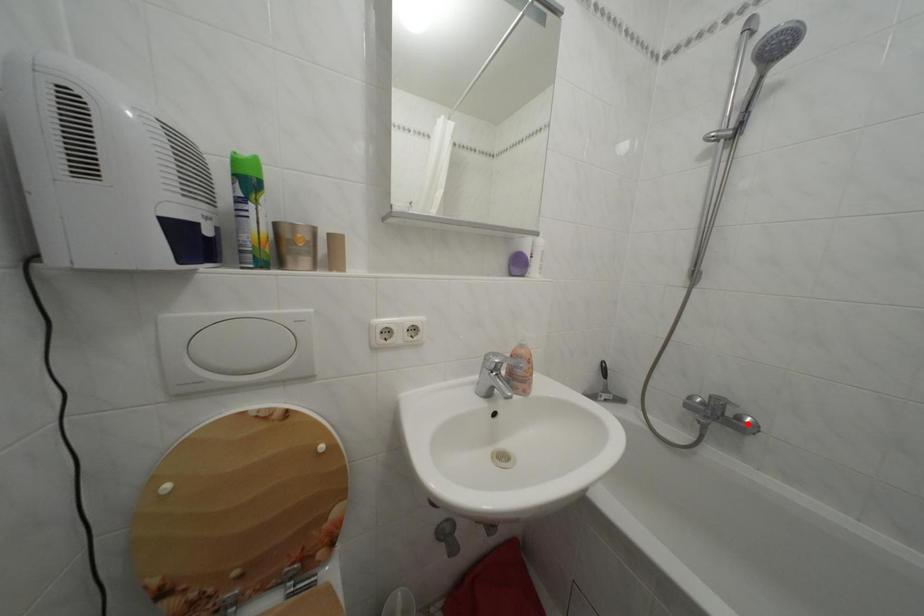
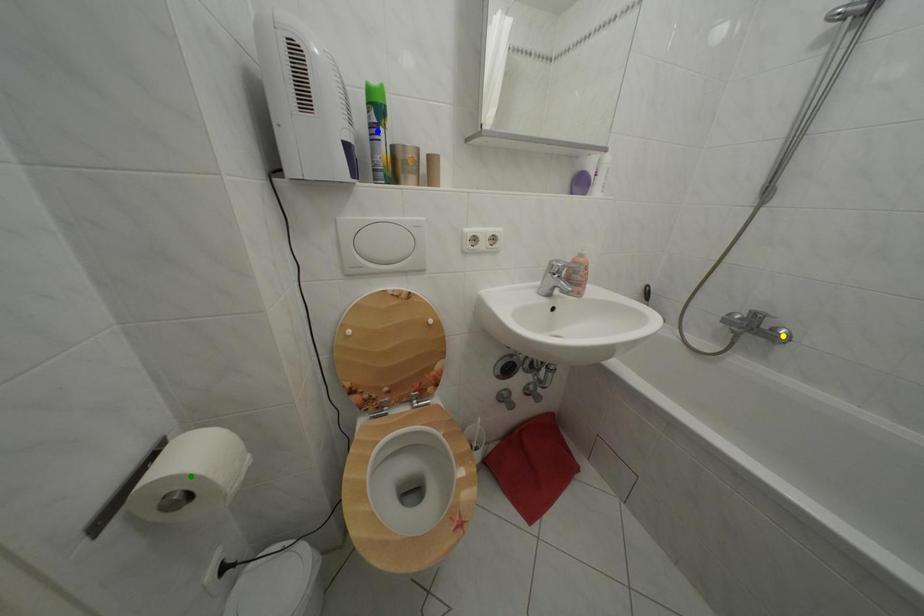
Question: I am providing you with two images of the same scene from different viewpoints. A red point is marked on the first image. You are given multiple points on the second image. In image 2, which mark is for the same physical point as the one in image 1?

Choices:
 (A) yellow point
 (B) blue point
 (C) green point

Answer: (A)